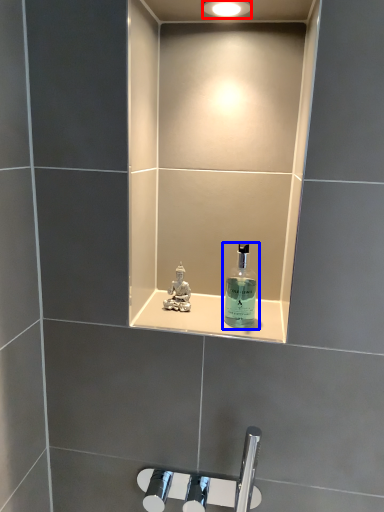
Question: Which of the following is the closest to the observer, light fixture (highlighted by a red box) or bottle (highlighted by a blue box)?

Choices:
 (A) light fixture
 (B) bottle

Answer: (A)